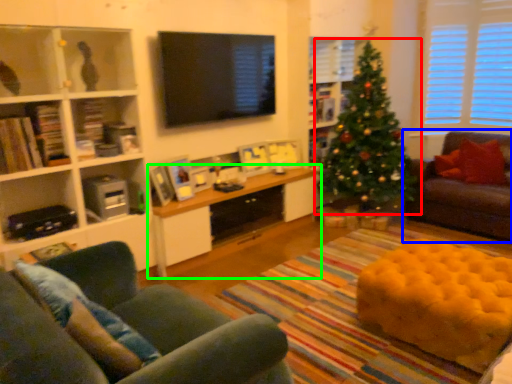
Question: Which object is positioned closest to christmas tree (highlighted by a red box)? Select from studio couch (highlighted by a blue box) and table (highlighted by a green box).

Choices:
 (A) studio couch
 (B) table

Answer: (A)